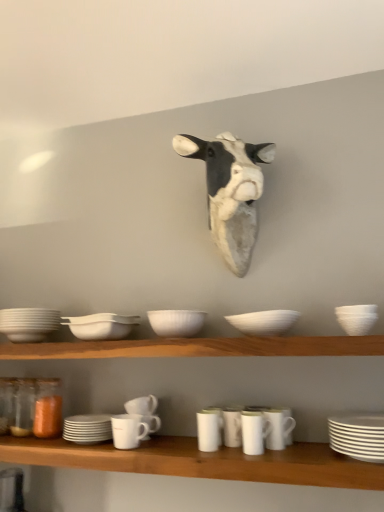
Question: Considering the relative sizes of white matte cups at lower center and white matte cup at center, which appears as the 6th tableware when viewed from the left, in the image provided, is white matte cups at lower center wider than white matte cup at center, which appears as the 6th tableware when viewed from the left,?

Choices:
 (A) yes
 (B) no

Answer: (A)

Question: Does white matte cups at lower center contain white matte cup at center, positioned as the 5th tableware in right-to-left order?

Choices:
 (A) yes
 (B) no

Answer: (B)

Question: Is white matte cups at lower center not close to white matte cup at center, positioned as the 5th tableware in right-to-left order?

Choices:
 (A) yes
 (B) no

Answer: (B)

Question: Is white matte cups at lower center outside of white matte cup at center, positioned as the 5th tableware in right-to-left order?

Choices:
 (A) no
 (B) yes

Answer: (B)

Question: Is white matte cups at lower center beside white matte cup at center, positioned as the 5th tableware in right-to-left order?

Choices:
 (A) yes
 (B) no

Answer: (B)

Question: Does white matte cups at lower center have a greater height compared to white matte cup at center, positioned as the 5th tableware in right-to-left order?

Choices:
 (A) yes
 (B) no

Answer: (B)

Question: Does translucent orange glass jar at lower left have a larger size compared to white matte cow head at center?

Choices:
 (A) yes
 (B) no

Answer: (B)

Question: Is translucent orange glass jar at lower left looking in the opposite direction of white matte cow head at center?

Choices:
 (A) yes
 (B) no

Answer: (B)

Question: Does translucent orange glass jar at lower left turn towards white matte cow head at center?

Choices:
 (A) no
 (B) yes

Answer: (A)

Question: Is white matte cow head at center located within translucent orange glass jar at lower left?

Choices:
 (A) yes
 (B) no

Answer: (B)

Question: Can you confirm if translucent orange glass jar at lower left is wider than white matte cow head at center?

Choices:
 (A) yes
 (B) no

Answer: (B)

Question: Is translucent orange glass jar at lower left further to the viewer compared to white matte cow head at center?

Choices:
 (A) no
 (B) yes

Answer: (B)

Question: Can you confirm if white glossy mug at center, which is the 4th tableware in right-to-left order, is shorter than white matte mug at lower center, the sixth tableware from the right?

Choices:
 (A) no
 (B) yes

Answer: (A)